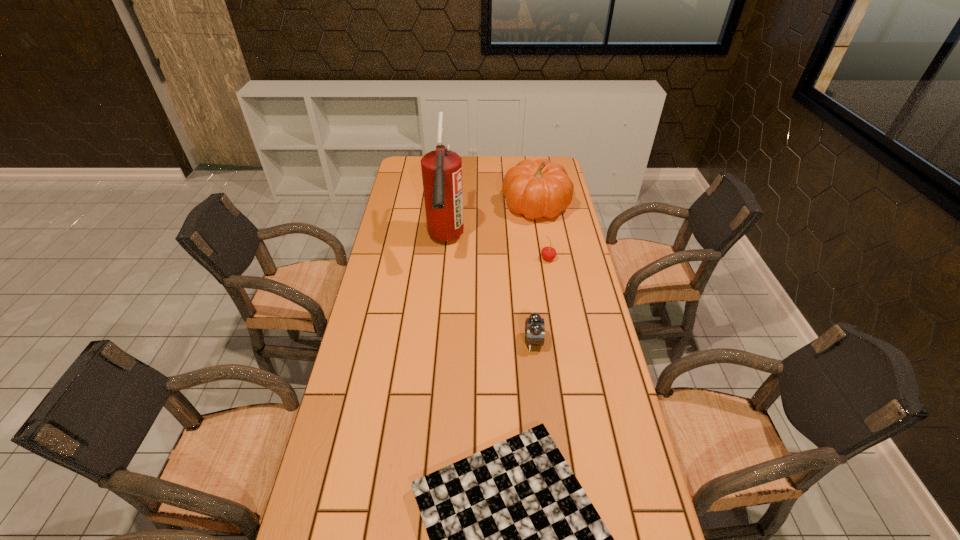
Image resolution: width=960 pixels, height=540 pixels. I want to click on pumpkin that is at the right edge, so click(x=536, y=189).

Where is `cherry that is positioned at the right edge`? The width and height of the screenshot is (960, 540). cherry that is positioned at the right edge is located at coordinates click(548, 253).

Image resolution: width=960 pixels, height=540 pixels. Find the location of `vacant position at the far edge of the desktop`. vacant position at the far edge of the desktop is located at coordinates pyautogui.click(x=469, y=157).

In the image, there is a desktop. Identify the location of free space at the left edge. Image resolution: width=960 pixels, height=540 pixels. (390, 264).

Locate an element on the screen. This screenshot has width=960, height=540. vacant region at the right edge of the desktop is located at coordinates (591, 407).

At what (x,y) coordinates should I click in order to perform the action: click on vacant space that's between the second tallest object and the cherry. Please return your answer as a coordinate pair (x, y). Image resolution: width=960 pixels, height=540 pixels. Looking at the image, I should click on tap(542, 232).

Image resolution: width=960 pixels, height=540 pixels. Find the location of `free space between the pumpkin and the alarm clock`. free space between the pumpkin and the alarm clock is located at coordinates (535, 274).

I want to click on vacant region between the tallest object and the fourth shortest object, so click(x=491, y=224).

This screenshot has width=960, height=540. I want to click on free space that is in between the pumpkin and the tallest object, so click(x=491, y=224).

Where is `free space between the tallest object and the cherry`? This screenshot has width=960, height=540. free space between the tallest object and the cherry is located at coordinates pos(496,250).